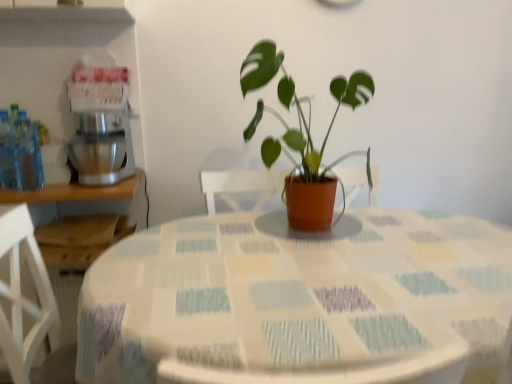
Question: Considering the relative sizes of textured fabric tablecloth at center and matte terracotta pot at center in the image provided, is textured fabric tablecloth at center bigger than matte terracotta pot at center?

Choices:
 (A) yes
 (B) no

Answer: (A)

Question: Does textured fabric tablecloth at center appear on the right side of matte terracotta pot at center?

Choices:
 (A) no
 (B) yes

Answer: (B)

Question: From a real-world perspective, does textured fabric tablecloth at center sit lower than matte terracotta pot at center?

Choices:
 (A) no
 (B) yes

Answer: (B)

Question: Is textured fabric tablecloth at center with matte terracotta pot at center?

Choices:
 (A) yes
 (B) no

Answer: (B)

Question: Is there a large distance between textured fabric tablecloth at center and matte terracotta pot at center?

Choices:
 (A) yes
 (B) no

Answer: (B)

Question: Is textured fabric tablecloth at center closer to the viewer compared to matte terracotta pot at center?

Choices:
 (A) no
 (B) yes

Answer: (B)

Question: From the image's perspective, is silver metallic mixer at left below matte terracotta pot at center?

Choices:
 (A) yes
 (B) no

Answer: (A)

Question: Is silver metallic mixer at left behind matte terracotta pot at center?

Choices:
 (A) yes
 (B) no

Answer: (A)

Question: Would you consider silver metallic mixer at left to be distant from matte terracotta pot at center?

Choices:
 (A) no
 (B) yes

Answer: (A)

Question: From a real-world perspective, is silver metallic mixer at left positioned over matte terracotta pot at center based on gravity?

Choices:
 (A) yes
 (B) no

Answer: (B)

Question: From the image's perspective, is silver metallic mixer at left above matte terracotta pot at center?

Choices:
 (A) yes
 (B) no

Answer: (B)

Question: Is silver metallic mixer at left at the right side of matte terracotta pot at center?

Choices:
 (A) yes
 (B) no

Answer: (B)

Question: Is silver metallic mixer at left surrounded by matte terracotta pot at center?

Choices:
 (A) no
 (B) yes

Answer: (A)